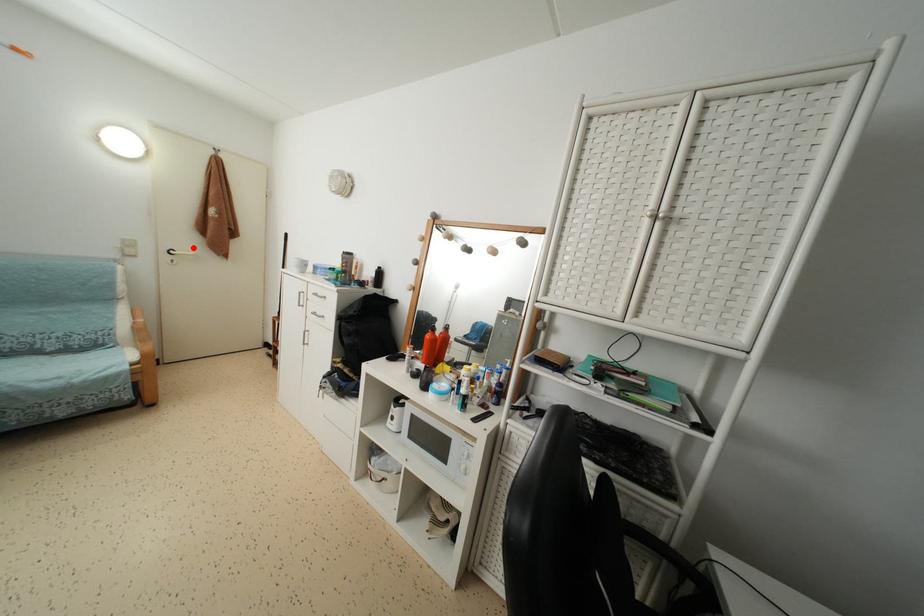
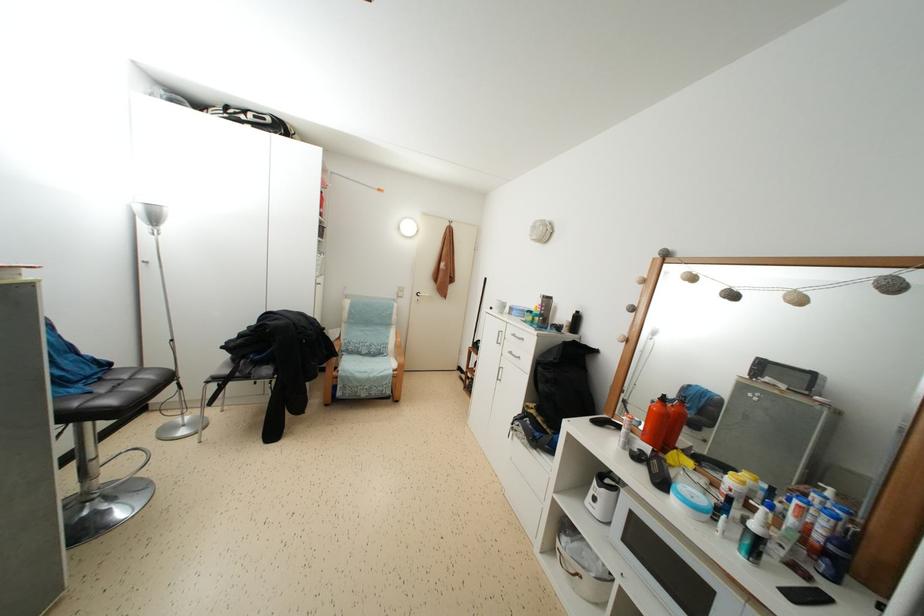
Find the pixel in the second image that matches the highlighted location in the first image.

(432, 293)